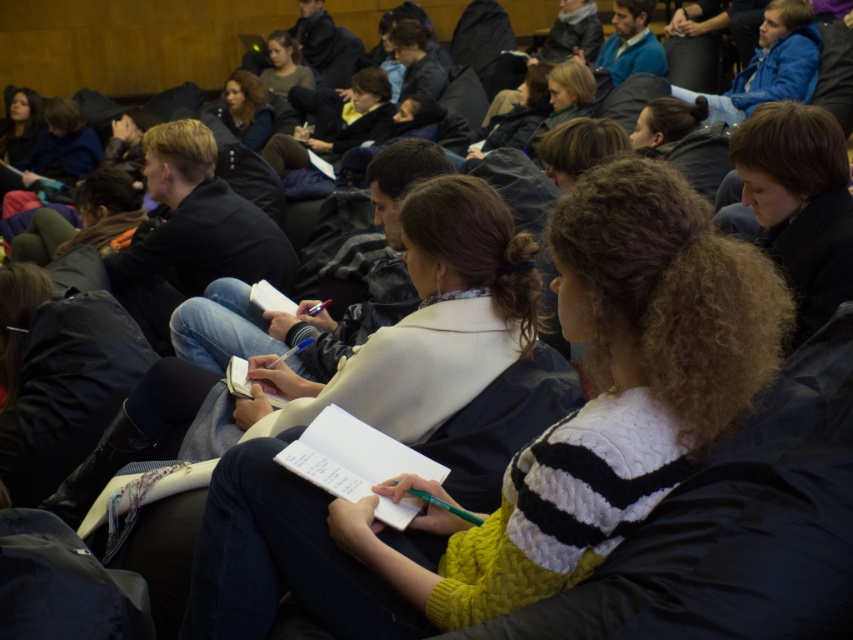
In the lecture hall scene, you need to determine which clothing item takes up more space in the image. The two items are the blue knit sweater at upper right and the matte black jacket at upper center. Which one is larger in size?

The blue knit sweater at upper right is bigger than the matte black jacket at upper center, so the blue knit sweater at upper right takes up more space in the image.

You are standing at the back of the lecture hall and want to see the presentation screen clearly. Which object, the yellow knit sweater at center or the blue cotton jacket at upper right, is closer to you?

The yellow knit sweater at center is closer to you because it is in front of the blue cotton jacket at upper right.